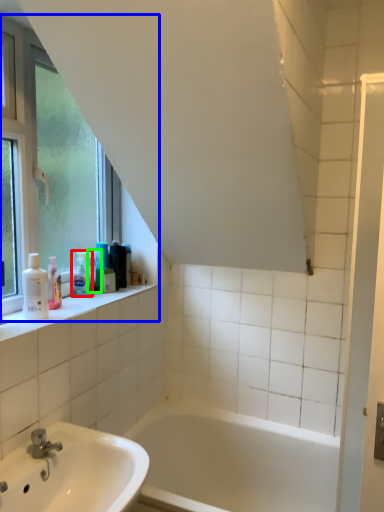
Question: Based on their relative distances, which object is farther from toiletry (highlighted by a red box)? Choose from window (highlighted by a blue box) and toiletry (highlighted by a green box).

Choices:
 (A) window
 (B) toiletry

Answer: (A)